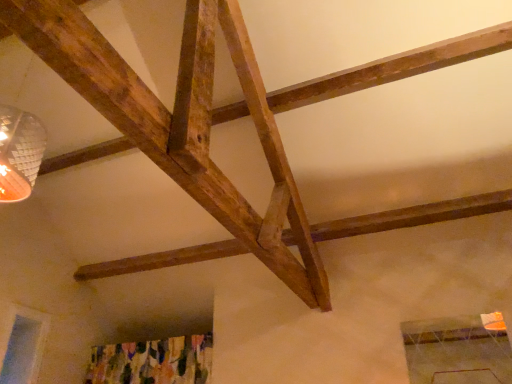
Find the location of a particular element. The width and height of the screenshot is (512, 384). clear glass window at lower left is located at coordinates (24, 347).

Describe the element at coordinates (24, 347) in the screenshot. I see `clear glass window at lower left` at that location.

The width and height of the screenshot is (512, 384). Identify the location of clear glass window at lower left. (24, 347).